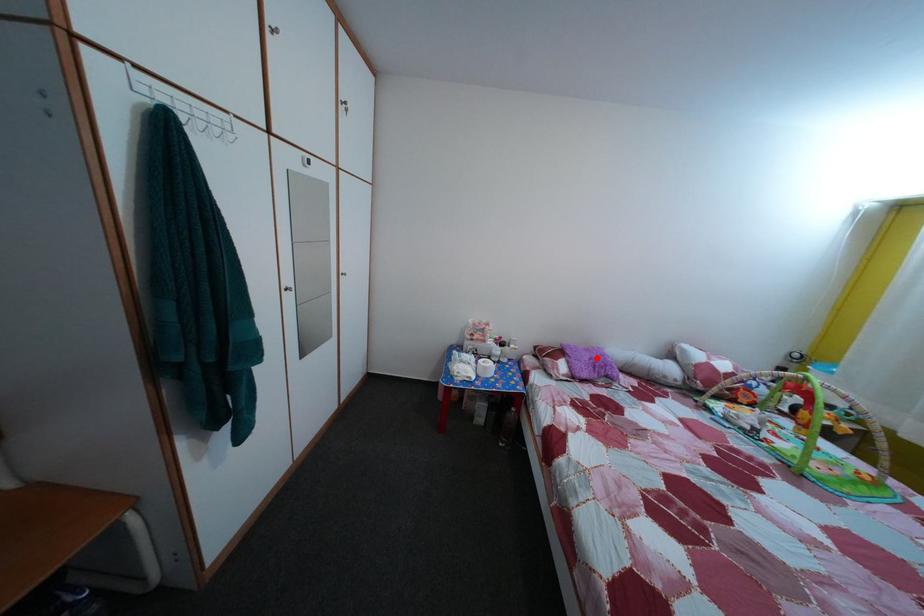
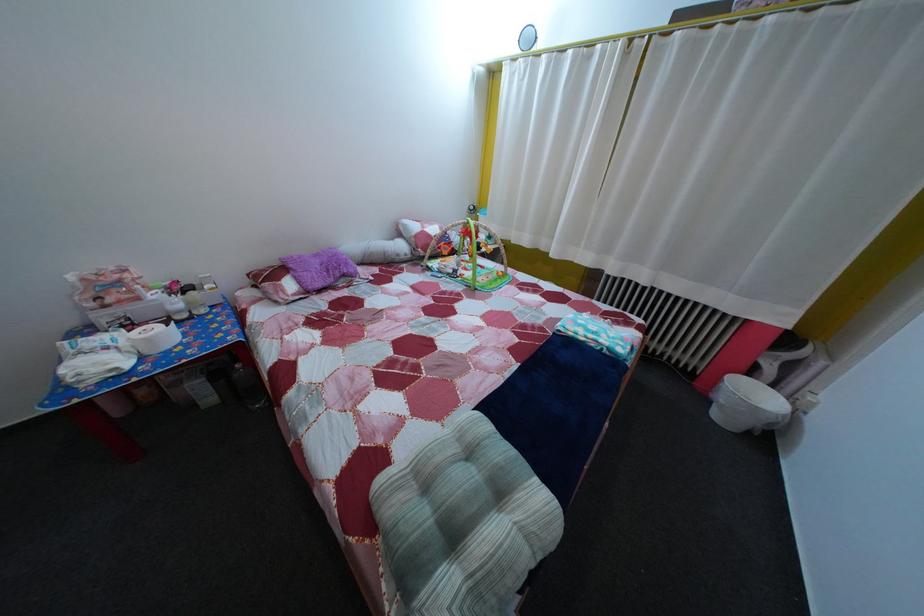
The point at the highlighted location is marked in the first image. Where is the corresponding point in the second image?

(325, 262)